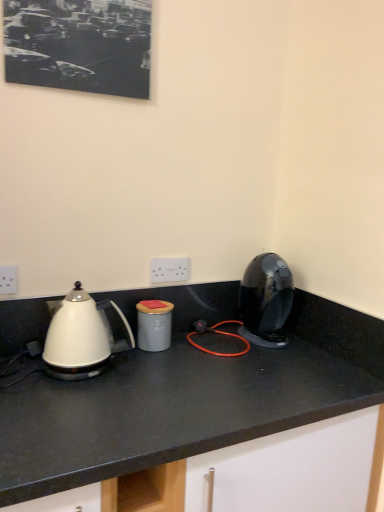
This screenshot has height=512, width=384. I want to click on vacant space underneath white glossy kettle at left (from a real-world perspective), so click(109, 370).